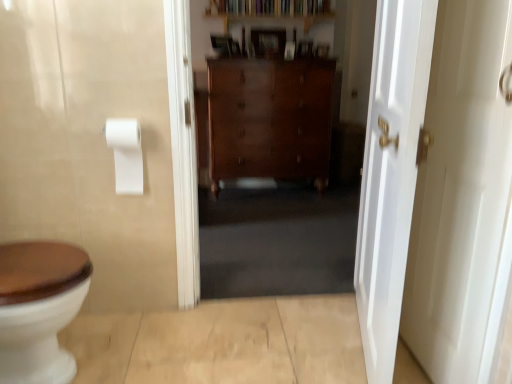
Question: Is white glossy door at right, which appears as the 2th door when viewed from the left, wider or thinner than white glossy door at right, positioned as the 2th door in right-to-left order?

Choices:
 (A) thin
 (B) wide

Answer: (A)

Question: Visually, is white glossy door at right, acting as the first door starting from the right, positioned to the left or to the right of white glossy door at right, arranged as the first door when viewed from the left?

Choices:
 (A) right
 (B) left

Answer: (A)

Question: Which is farther from the white glossy door at right, acting as the first door starting from the right?

Choices:
 (A) white glossy door at right, arranged as the first door when viewed from the left
 (B) wooden bookshelf at upper center
 (C) white matte toilet paper at upper left
 (D) polished wood dresser at center

Answer: (B)

Question: Estimate the real-world distances between objects in this image. Which object is farther from the white glossy door at right, positioned as the 2th door in right-to-left order?

Choices:
 (A) white matte toilet paper at upper left
 (B) white glossy door at right, which appears as the 2th door when viewed from the left
 (C) polished wood dresser at center
 (D) wooden bookshelf at upper center

Answer: (D)